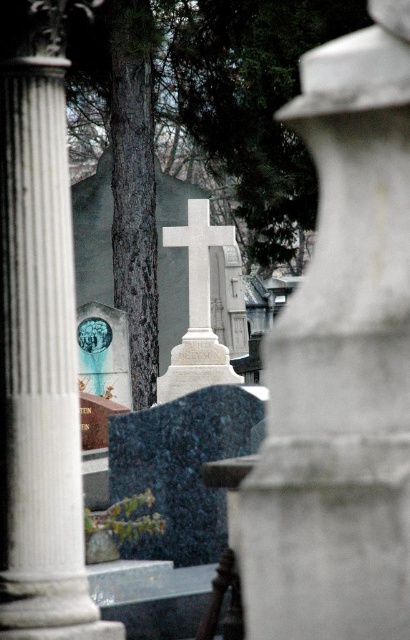
You are a photographer planning to take a wide shot of the cemetery scene. You want to ensure both the white marble column at left and the white marble cross at center are fully visible in the frame. Based on their sizes, which object should you prioritize positioning closer to the camera to maintain their visibility?

The white marble column at left occupies less space than the white marble cross at center, so you should prioritize positioning the white marble cross at center closer to the camera to ensure both are fully visible.

You are standing at the entrance of the cemetery and want to locate the white marble pillar at center. According to the coordinates provided, where should you look relative to the central cross?

The white marble pillar at center is located at coordinates point (341, 364), which places it to the right and slightly below the central cross.